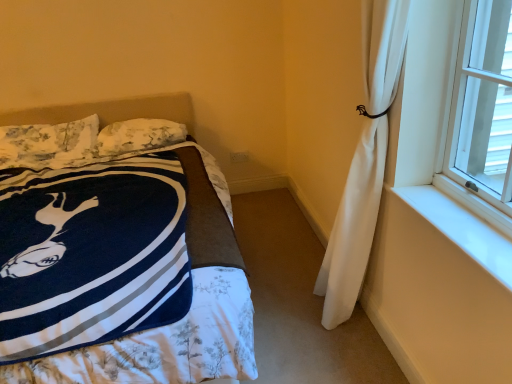
Question: Would you say floral fabric pillow at upper left, which is the second pillow from right to left, is outside navy blue fleece blanket at left?

Choices:
 (A) no
 (B) yes

Answer: (A)

Question: From a real-world perspective, does floral fabric pillow at upper left, which is the second pillow from right to left, sit lower than navy blue fleece blanket at left?

Choices:
 (A) yes
 (B) no

Answer: (B)

Question: Can you confirm if floral fabric pillow at upper left, which is the second pillow from right to left, is positioned to the right of navy blue fleece blanket at left?

Choices:
 (A) yes
 (B) no

Answer: (B)

Question: Is floral fabric pillow at upper left, arranged as the 1th pillow when viewed from the left, thinner than navy blue fleece blanket at left?

Choices:
 (A) yes
 (B) no

Answer: (A)

Question: From a real-world perspective, does floral fabric pillow at upper left, which is the second pillow from right to left, stand above navy blue fleece blanket at left?

Choices:
 (A) yes
 (B) no

Answer: (A)

Question: From a real-world perspective, is navy blue fleece blanket at left above or below fluffy white pillow at upper left, the 2th pillow in the left-to-right sequence?

Choices:
 (A) above
 (B) below

Answer: (B)

Question: Considering the positions of navy blue fleece blanket at left and fluffy white pillow at upper left, the first pillow when ordered from right to left, in the image, is navy blue fleece blanket at left taller or shorter than fluffy white pillow at upper left, the first pillow when ordered from right to left,?

Choices:
 (A) short
 (B) tall

Answer: (B)

Question: Based on their positions, is navy blue fleece blanket at left located to the left or right of fluffy white pillow at upper left, the 2th pillow in the left-to-right sequence?

Choices:
 (A) right
 (B) left

Answer: (B)

Question: Considering the positions of navy blue fleece blanket at left and fluffy white pillow at upper left, the 2th pillow in the left-to-right sequence, in the image, is navy blue fleece blanket at left bigger or smaller than fluffy white pillow at upper left, the 2th pillow in the left-to-right sequence,?

Choices:
 (A) small
 (B) big

Answer: (B)

Question: From the image's perspective, relative to navy blue fleece blanket at left, is fluffy white pillow at upper left, the 2th pillow in the left-to-right sequence, above or below?

Choices:
 (A) below
 (B) above

Answer: (B)

Question: Would you say fluffy white pillow at upper left, the 2th pillow in the left-to-right sequence, is inside or outside navy blue fleece blanket at left?

Choices:
 (A) outside
 (B) inside

Answer: (B)

Question: Considering the positions of fluffy white pillow at upper left, the 2th pillow in the left-to-right sequence, and navy blue fleece blanket at left in the image, is fluffy white pillow at upper left, the 2th pillow in the left-to-right sequence, bigger or smaller than navy blue fleece blanket at left?

Choices:
 (A) big
 (B) small

Answer: (B)

Question: In the image, is fluffy white pillow at upper left, the 2th pillow in the left-to-right sequence, positioned in front of or behind navy blue fleece blanket at left?

Choices:
 (A) behind
 (B) front

Answer: (A)

Question: Based on their positions, is floral fabric pillow at upper left, arranged as the 1th pillow when viewed from the left, located to the left or right of white smooth window sill at right?

Choices:
 (A) left
 (B) right

Answer: (A)

Question: Relative to white smooth window sill at right, is floral fabric pillow at upper left, which is the second pillow from right to left, in front or behind?

Choices:
 (A) front
 (B) behind

Answer: (B)